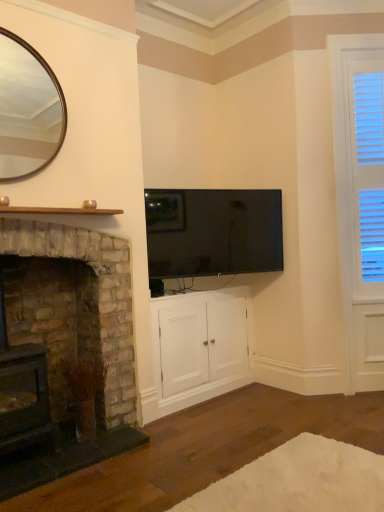
This screenshot has height=512, width=384. I want to click on blank space situated above white fluffy rug at lower center (from a real-world perspective), so click(293, 481).